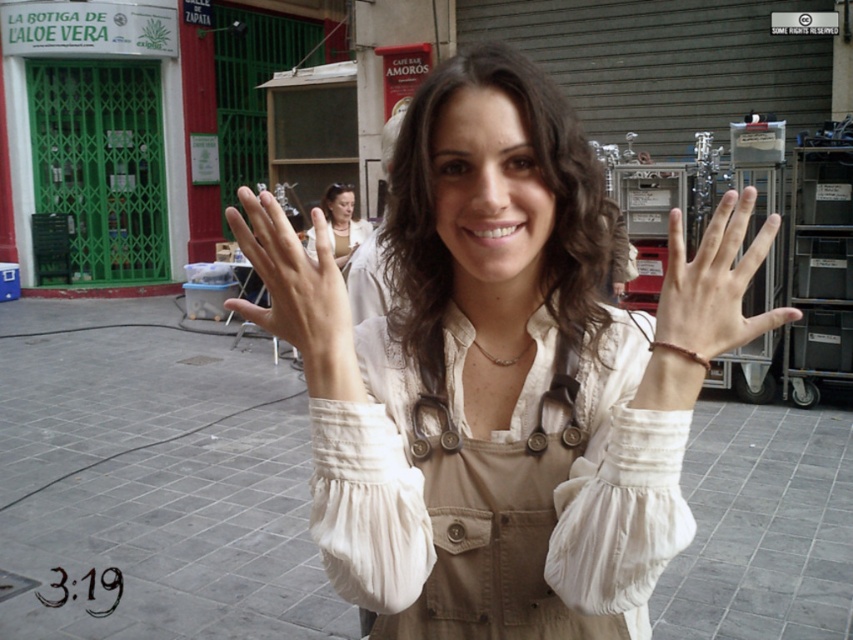
Is point (686, 317) positioned after point (520, 356)?

No.

Does smooth beige hand at center have a greater width compared to pearl necklace at center?

Correct, the width of smooth beige hand at center exceeds that of pearl necklace at center.

Where is `smooth beige hand at center`? The height and width of the screenshot is (640, 853). smooth beige hand at center is located at coordinates (715, 282).

Locate an element on the screen. The height and width of the screenshot is (640, 853). smooth beige hand at center is located at coordinates (715, 282).

Is beige cotton jumpsuit at center to the left of smooth beige hand at center from the viewer's perspective?

Correct, you'll find beige cotton jumpsuit at center to the left of smooth beige hand at center.

Is beige cotton jumpsuit at center bigger than smooth beige hand at center?

No.

Image resolution: width=853 pixels, height=640 pixels. In order to click on beige cotton jumpsuit at center in this screenshot , I will do click(618, 488).

Identify the location of white cotton shirt at center. (500, 374).

Between point (534, 440) and point (253, 232), which one is positioned in front?

Positioned in front is point (534, 440).

Identify the location of white cotton shirt at center. The image size is (853, 640). (500, 374).